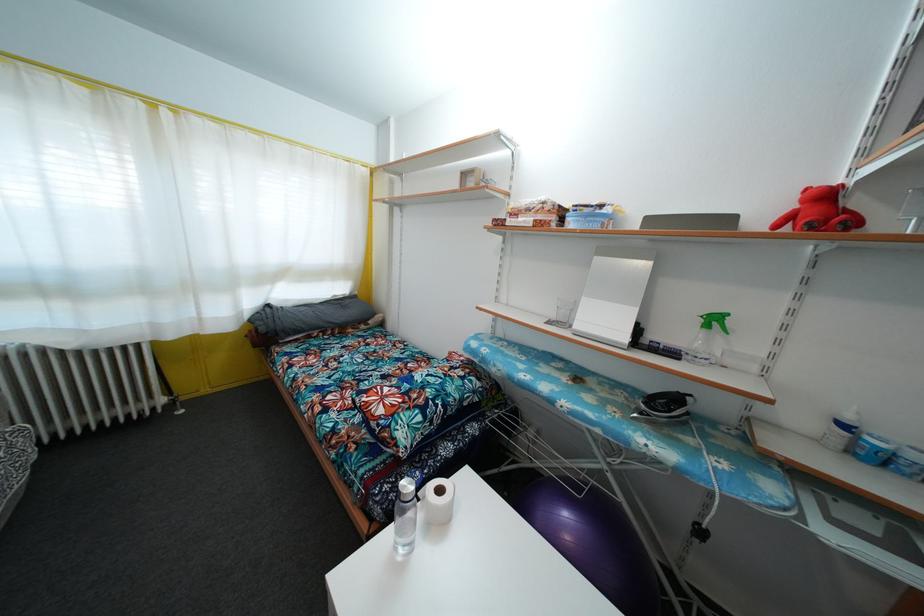
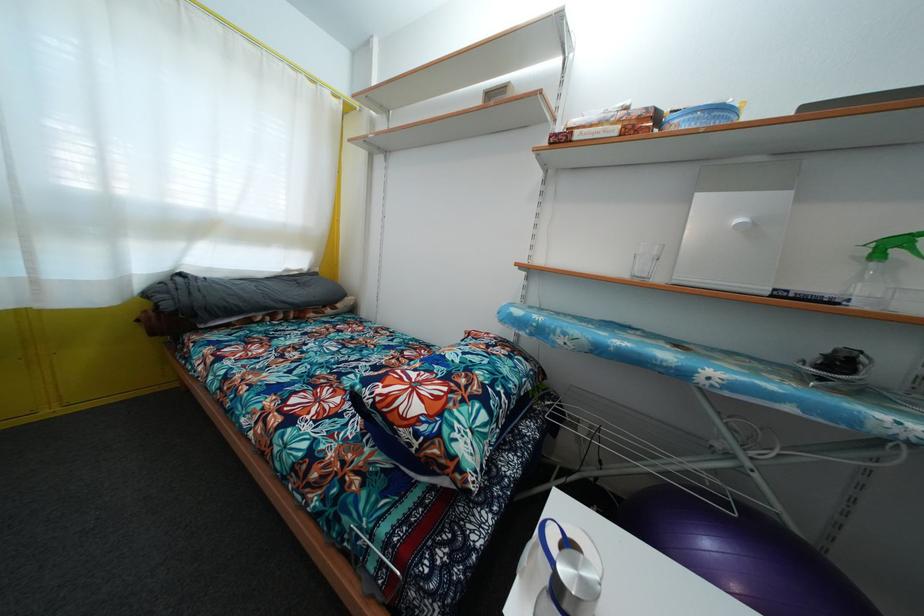
Question: Based on the continuous images, in which direction is the camera rotating? Reply with the corresponding letter.

Choices:
 (A) Left
 (B) Right
 (C) Up
 (D) Down

Answer: (B)